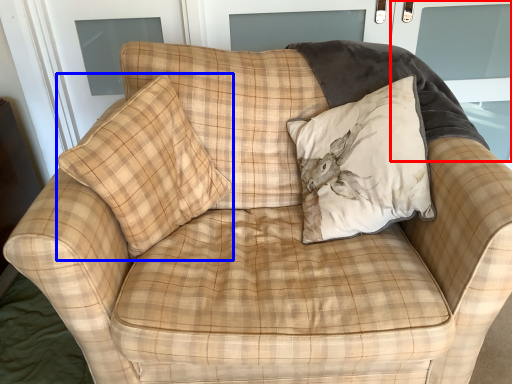
Question: Which point is further to the camera, screen door (highlighted by a red box) or pillow (highlighted by a blue box)?

Choices:
 (A) screen door
 (B) pillow

Answer: (A)